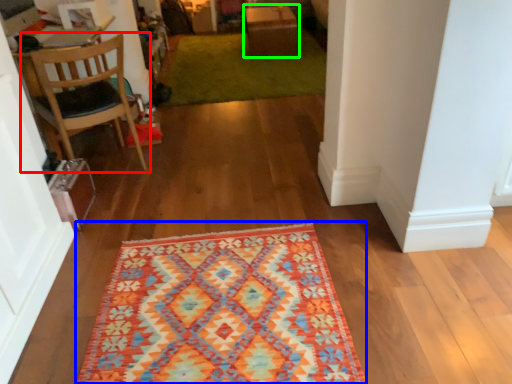
Question: Which object is the farthest from chair (highlighted by a red box)? Choose among these: mat (highlighted by a blue box) or table (highlighted by a green box).

Choices:
 (A) mat
 (B) table

Answer: (B)